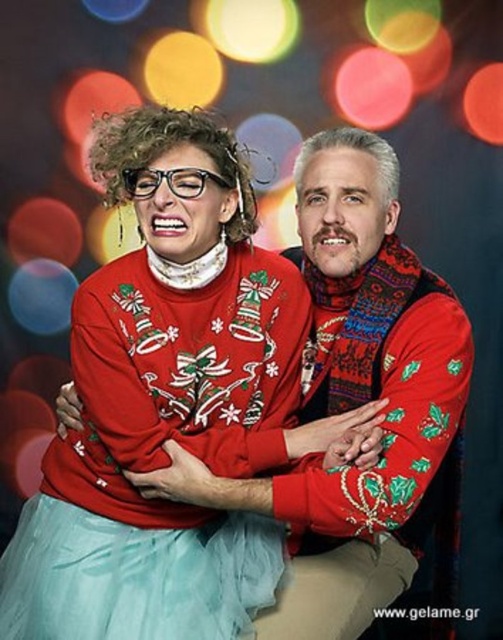
Is point (204, 365) positioned before point (3, 586)?

Yes, point (204, 365) is closer to viewer.

Between matte red sweater at center and light blue tulle ballet skirt at lower left, which one has more height?

With more height is matte red sweater at center.

Measure the distance between matte red sweater at center and camera.

matte red sweater at center is 4.65 feet from camera.

At what (x,y) coordinates should I click in order to perform the action: click on matte red sweater at center. Please return your answer as a coordinate pair (x, y). The width and height of the screenshot is (503, 640). Looking at the image, I should click on (172, 404).